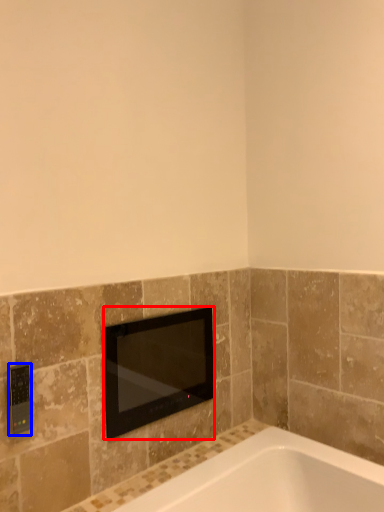
Question: Which point is further to the camera, television (highlighted by a red box) or light switch (highlighted by a blue box)?

Choices:
 (A) television
 (B) light switch

Answer: (A)